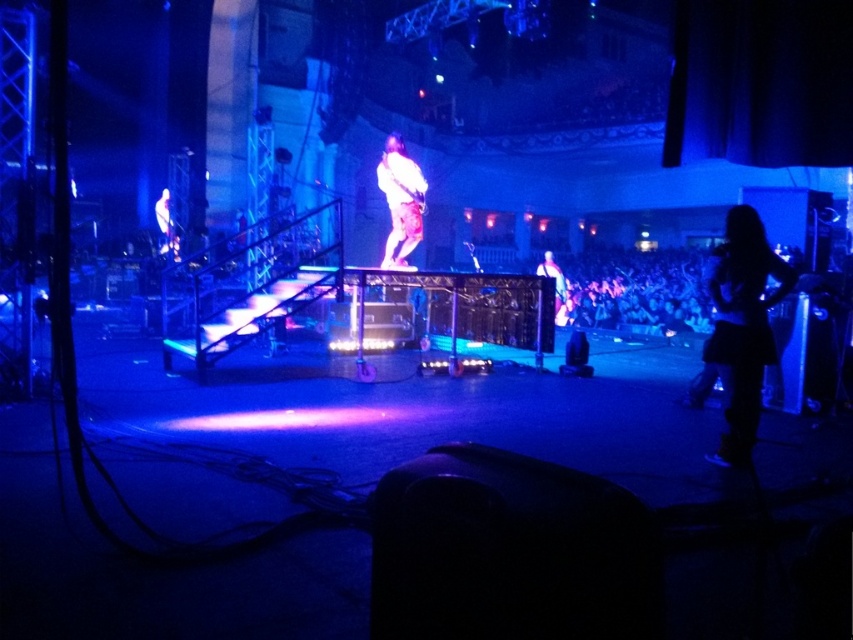
Question: Can you confirm if shiny purple guitar at center is positioned to the right of shiny silver guitar at center?

Choices:
 (A) yes
 (B) no

Answer: (B)

Question: Based on their relative distances, which object is farther from the shiny silver guitar at center?

Choices:
 (A) white fabric at upper left
 (B) shiny purple guitar at center
 (C) black matte skirt at lower right

Answer: (C)

Question: From the image, what is the correct spatial relationship of black matte skirt at lower right in relation to shiny silver guitar at center?

Choices:
 (A) right
 (B) left

Answer: (B)

Question: Which object is the closest to the shiny silver guitar at center?

Choices:
 (A) white fabric at upper left
 (B) shiny purple guitar at center

Answer: (B)

Question: Which point is closer to the camera?

Choices:
 (A) black matte skirt at lower right
 (B) shiny silver guitar at center

Answer: (A)

Question: Is shiny silver guitar at center to the left of white fabric at upper left from the viewer's perspective?

Choices:
 (A) yes
 (B) no

Answer: (B)